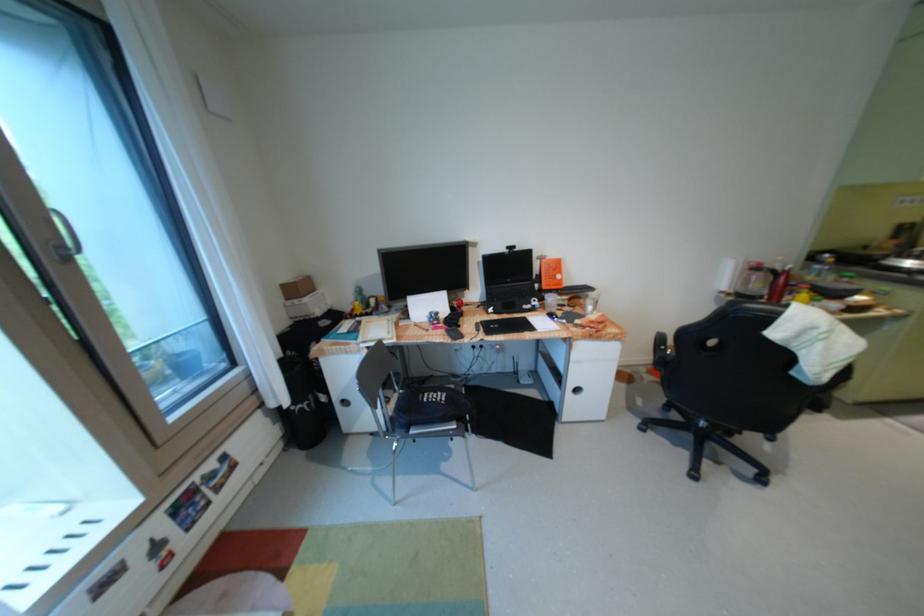
Locate an element on the screen. The height and width of the screenshot is (616, 924). window handle is located at coordinates point(65,237).